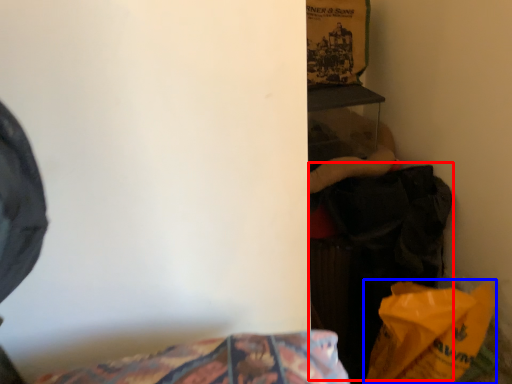
Question: Among these objects, which one is nearest to the camera, clothing (highlighted by a red box) or paper bag (highlighted by a blue box)?

Choices:
 (A) clothing
 (B) paper bag

Answer: (B)